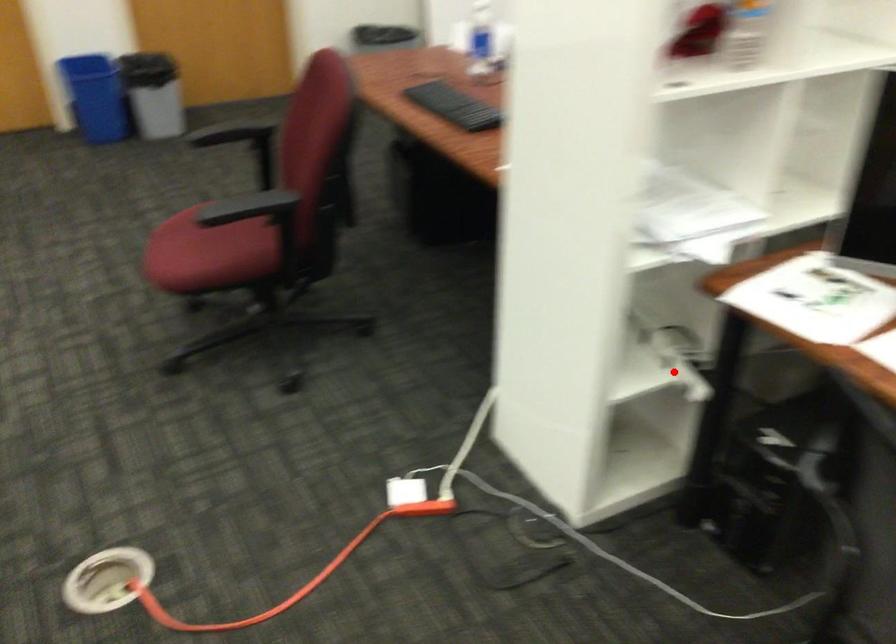
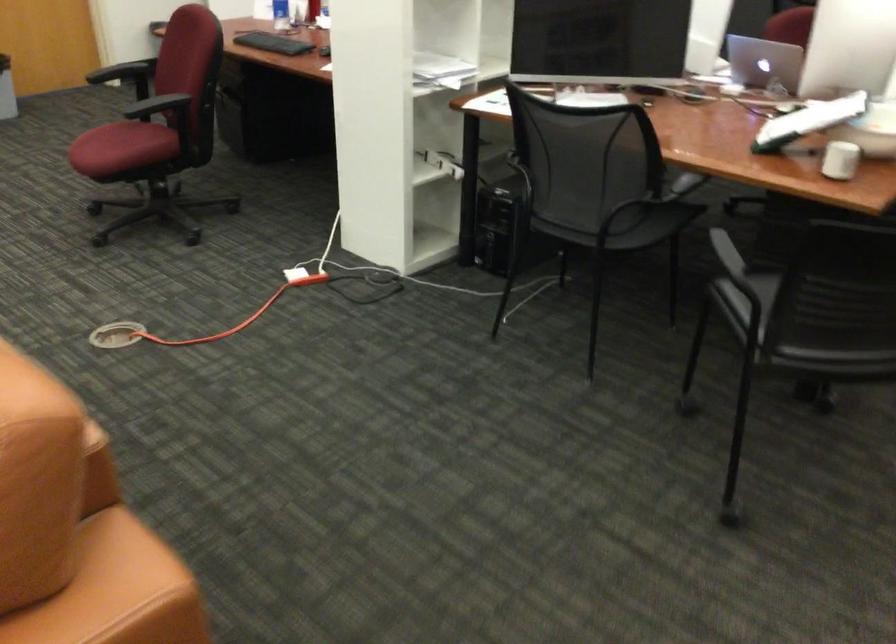
Question: I am providing you with two images of the same scene from different viewpoints. Image1 has a red point marked. In image2, the corresponding 3D location appears at what relative position? Reply with the corresponding letter.

Choices:
 (A) Closer
 (B) Farther

Answer: (B)